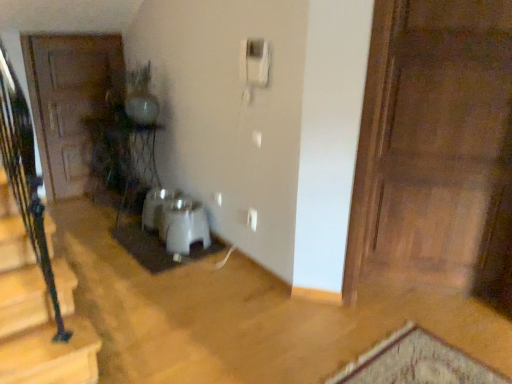
The image size is (512, 384). Find the location of `empty space that is ontop of wooden door at left, which ranks as the first door in back-to-front order (from a real-world perspective)`. empty space that is ontop of wooden door at left, which ranks as the first door in back-to-front order (from a real-world perspective) is located at coordinates (79, 31).